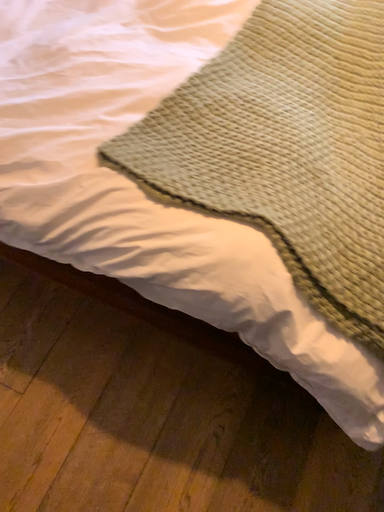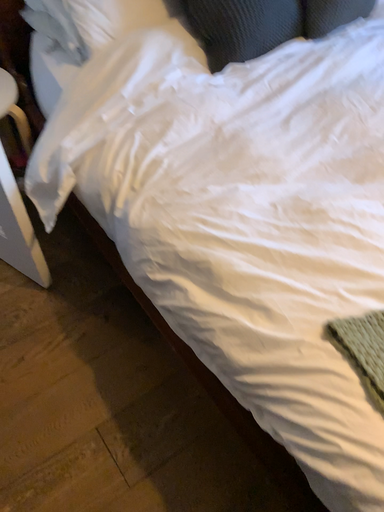
Question: Which way did the camera rotate in the video?

Choices:
 (A) rotated upward
 (B) rotated downward

Answer: (A)